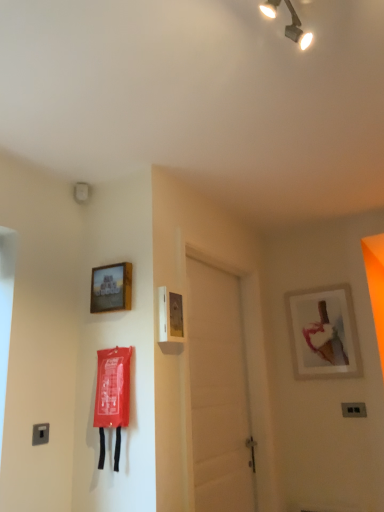
In order to face satin silver switch at lower left, the second light switch in the back-to-front sequence, should I rotate leftwards or rightwards?

You should look left and rotate roughly 19.388 degrees.

In order to click on metallic track lighting at upper center in this screenshot , I will do coord(297,29).

This screenshot has width=384, height=512. What are the coordinates of `wooden frame at upper left, placed as the 2th picture frame when sorted from bottom to top` in the screenshot? It's located at (111, 288).

You are a GUI agent. You are given a task and a screenshot of the screen. Output one action in this format:
    pyautogui.click(x=<x>, y=<y>)
    Task: Click on the white matte door at center
    Image resolution: width=384 pixels, height=512 pixels.
    Given the screenshot: What is the action you would take?
    pyautogui.click(x=218, y=392)

Visually, is black plastic light switch at lower right, which ranks as the first light switch in right-to-left order, positioned to the left or to the right of metallic track lighting at upper center?

Clearly, black plastic light switch at lower right, which ranks as the first light switch in right-to-left order, is on the right of metallic track lighting at upper center in the image.

Is point (350, 410) closer or farther from the camera than point (295, 34)?

Point (350, 410) is positioned farther from the camera compared to point (295, 34).

Is black plastic light switch at lower right, which ranks as the 2th light switch in left-to-right order, looking in the opposite direction of metallic track lighting at upper center?

That's not correct — black plastic light switch at lower right, which ranks as the 2th light switch in left-to-right order, is not looking away from metallic track lighting at upper center.

From the picture: From the image's perspective, is black plastic light switch at lower right, marked as the 1th light switch in a bottom-to-top arrangement, below metallic track lighting at upper center?

Correct, black plastic light switch at lower right, marked as the 1th light switch in a bottom-to-top arrangement, appears lower than metallic track lighting at upper center in the image.

Can you confirm if satin silver switch at lower left, arranged as the second light switch when viewed from the right, is positioned to the right of matte white picture frame at upper right, which is the 1th picture frame in right-to-left order?

No.

Is satin silver switch at lower left, arranged as the second light switch when viewed from the right, shorter than matte white picture frame at upper right, which is the 2th picture frame in front-to-back order?

Yes, satin silver switch at lower left, arranged as the second light switch when viewed from the right, is shorter than matte white picture frame at upper right, which is the 2th picture frame in front-to-back order.

Which light switch is the 2nd one when counting from the front of the matte white picture frame at upper right, the 2th picture frame when ordered from top to bottom? Please provide its 2D coordinates.

[(40, 434)]

From a real-world perspective, is satin silver switch at lower left, arranged as the second light switch when viewed from the right, physically located above or below black plastic light switch at lower right, which appears as the 2th light switch when viewed from the front?

satin silver switch at lower left, arranged as the second light switch when viewed from the right, is situated higher than black plastic light switch at lower right, which appears as the 2th light switch when viewed from the front, in the real world.

From the image's perspective, would you say satin silver switch at lower left, the second light switch when ordered from bottom to top, is shown under black plastic light switch at lower right, which ranks as the 2th light switch in left-to-right order?

No, from the image's perspective, satin silver switch at lower left, the second light switch when ordered from bottom to top, is not beneath black plastic light switch at lower right, which ranks as the 2th light switch in left-to-right order.

Is black plastic light switch at lower right, marked as the 1th light switch in a bottom-to-top arrangement, surrounded by satin silver switch at lower left, placed as the 1th light switch when sorted from front to back?

No.

Is satin silver switch at lower left, placed as the 1th light switch when sorted from left to right, oriented away from black plastic light switch at lower right, which appears as the 2th light switch when viewed from the front?

satin silver switch at lower left, placed as the 1th light switch when sorted from left to right, does not have its back to black plastic light switch at lower right, which appears as the 2th light switch when viewed from the front.

Can you tell me how much metallic track lighting at upper center and satin silver switch at lower left, the second light switch in the back-to-front sequence, differ in facing direction?

The facing directions of metallic track lighting at upper center and satin silver switch at lower left, the second light switch in the back-to-front sequence, are 93 degrees apart.

How far apart are metallic track lighting at upper center and satin silver switch at lower left, the second light switch in the back-to-front sequence?

A distance of 6.02 feet exists between metallic track lighting at upper center and satin silver switch at lower left, the second light switch in the back-to-front sequence.

In the scene shown: From a real-world perspective, which is physically above, metallic track lighting at upper center or satin silver switch at lower left, arranged as the second light switch when viewed from the right?

metallic track lighting at upper center, from a real-world perspective.

Based on the photo, considering the relative positions of metallic track lighting at upper center and satin silver switch at lower left, marked as the first light switch in a top-to-bottom arrangement, in the image provided, is metallic track lighting at upper center behind satin silver switch at lower left, marked as the first light switch in a top-to-bottom arrangement,?

No, metallic track lighting at upper center is closer to the viewer.

Between white matte door at center and satin silver switch at lower left, placed as the 1th light switch when sorted from left to right, which one appears on the left side from the viewer's perspective?

satin silver switch at lower left, placed as the 1th light switch when sorted from left to right, is more to the left.

Measure the distance from white matte door at center to satin silver switch at lower left, marked as the first light switch in a top-to-bottom arrangement.

white matte door at center is 3.34 feet away from satin silver switch at lower left, marked as the first light switch in a top-to-bottom arrangement.

In the scene shown: Between white matte door at center and satin silver switch at lower left, the second light switch when ordered from bottom to top, which one is positioned behind?

white matte door at center is behind.

Which point is more forward, (105, 282) or (342, 324)?

The point (105, 282) is in front.

Can you tell me how much wooden frame at upper left, placed as the second picture frame when sorted from right to left, and matte white picture frame at upper right, the 2th picture frame when ordered from top to bottom, differ in facing direction?

0.76 degrees.

Can you confirm if wooden frame at upper left, the first picture frame viewed from the left, is positioned to the left of matte white picture frame at upper right, the 2th picture frame when ordered from top to bottom?

Correct, you'll find wooden frame at upper left, the first picture frame viewed from the left, to the left of matte white picture frame at upper right, the 2th picture frame when ordered from top to bottom.

From the image's perspective, is wooden frame at upper left, the 1th picture frame when ordered from front to back, located beneath matte white picture frame at upper right, which is the 1th picture frame in right-to-left order?

Incorrect, from the image's perspective, wooden frame at upper left, the 1th picture frame when ordered from front to back, is higher than matte white picture frame at upper right, which is the 1th picture frame in right-to-left order.

Locate an element on the screen. This screenshot has width=384, height=512. light switch on the right of wooden frame at upper left, the 1th picture frame positioned from the top is located at coordinates (354, 410).

Can we say black plastic light switch at lower right, marked as the 2th light switch in a top-to-bottom arrangement, lies outside wooden frame at upper left, the 1th picture frame when ordered from front to back?

black plastic light switch at lower right, marked as the 2th light switch in a top-to-bottom arrangement, is positioned outside wooden frame at upper left, the 1th picture frame when ordered from front to back.

Is the position of black plastic light switch at lower right, marked as the 1th light switch in a bottom-to-top arrangement, more distant than that of wooden frame at upper left, placed as the 2th picture frame when sorted from bottom to top?

Yes, it is.

Can you confirm if black plastic light switch at lower right, which is the first light switch in back-to-front order, is bigger than wooden frame at upper left, the first picture frame viewed from the left?

No.

Where is `lamp positioned vertically above the black plastic light switch at lower right, marked as the 2th light switch in a top-to-bottom arrangement (from a real-world perspective)`? The width and height of the screenshot is (384, 512). lamp positioned vertically above the black plastic light switch at lower right, marked as the 2th light switch in a top-to-bottom arrangement (from a real-world perspective) is located at coordinates (297, 29).

You are a GUI agent. You are given a task and a screenshot of the screen. Output one action in this format:
    pyautogui.click(x=<x>, y=<y>)
    Task: Click on the 1st light switch below when counting from the matte white picture frame at upper right, which is the 2th picture frame in front-to-back order (from the image's perspective)
    
    Given the screenshot: What is the action you would take?
    pyautogui.click(x=40, y=434)

From the image, which object appears to be nearer to white matte door at center, wooden frame at upper left, the 1th picture frame when ordered from front to back, or satin silver switch at lower left, the second light switch when ordered from bottom to top?

wooden frame at upper left, the 1th picture frame when ordered from front to back, is closer to white matte door at center.

Considering their positions, is matte white picture frame at upper right, which appears as the 1th picture frame when viewed from the back, positioned closer to white matte door at center than wooden frame at upper left, the first picture frame viewed from the left?

The object closer to white matte door at center is matte white picture frame at upper right, which appears as the 1th picture frame when viewed from the back.

Which object lies further to the anchor point black plastic light switch at lower right, which ranks as the first light switch in right-to-left order, satin silver switch at lower left, arranged as the second light switch when viewed from the right, or white matte door at center?

satin silver switch at lower left, arranged as the second light switch when viewed from the right, is positioned further to the anchor black plastic light switch at lower right, which ranks as the first light switch in right-to-left order.

Based on the photo, estimate the real-world distances between objects in this image. Which object is closer to metallic track lighting at upper center, black plastic light switch at lower right, which appears as the 2th light switch when viewed from the front, or white matte door at center?

white matte door at center.

From the image, which object appears to be nearer to wooden frame at upper left, positioned as the second picture frame in back-to-front order, matte white picture frame at upper right, which is the 2th picture frame in front-to-back order, or black plastic light switch at lower right, which is the first light switch in back-to-front order?

matte white picture frame at upper right, which is the 2th picture frame in front-to-back order, is positioned closer to the anchor wooden frame at upper left, positioned as the second picture frame in back-to-front order.

Consider the image. Estimate the real-world distances between objects in this image. Which object is further from matte white picture frame at upper right, which appears as the 1th picture frame when viewed from the back, metallic track lighting at upper center or white matte door at center?

The object further to matte white picture frame at upper right, which appears as the 1th picture frame when viewed from the back, is metallic track lighting at upper center.

Estimate the real-world distances between objects in this image. Which object is closer to white matte door at center, satin silver switch at lower left, arranged as the second light switch when viewed from the right, or matte white picture frame at upper right, arranged as the 2th picture frame when viewed from the left?

matte white picture frame at upper right, arranged as the 2th picture frame when viewed from the left, is closer to white matte door at center.

From the image, which object appears to be farther from metallic track lighting at upper center, white matte door at center or matte white picture frame at upper right, which is the 2th picture frame in front-to-back order?

Based on the image, matte white picture frame at upper right, which is the 2th picture frame in front-to-back order, appears to be further to metallic track lighting at upper center.

Locate an element on the screen. The image size is (384, 512). door situated between satin silver switch at lower left, placed as the 1th light switch when sorted from left to right, and black plastic light switch at lower right, which ranks as the 2th light switch in left-to-right order, from left to right is located at coordinates (218, 392).

Image resolution: width=384 pixels, height=512 pixels. I want to click on door located between wooden frame at upper left, positioned as the second picture frame in back-to-front order, and black plastic light switch at lower right, which is the first light switch in back-to-front order, in the left-right direction, so click(x=218, y=392).

In order to click on door between metallic track lighting at upper center and matte white picture frame at upper right, which is the first picture frame from bottom to top, in the front-back direction in this screenshot , I will do `click(218, 392)`.

You are a GUI agent. You are given a task and a screenshot of the screen. Output one action in this format:
    pyautogui.click(x=<x>, y=<y>)
    Task: Click on the picture frame between wooden frame at upper left, the 1th picture frame positioned from the top, and black plastic light switch at lower right, marked as the 1th light switch in a bottom-to-top arrangement, in the horizontal direction
    
    Given the screenshot: What is the action you would take?
    pyautogui.click(x=323, y=333)